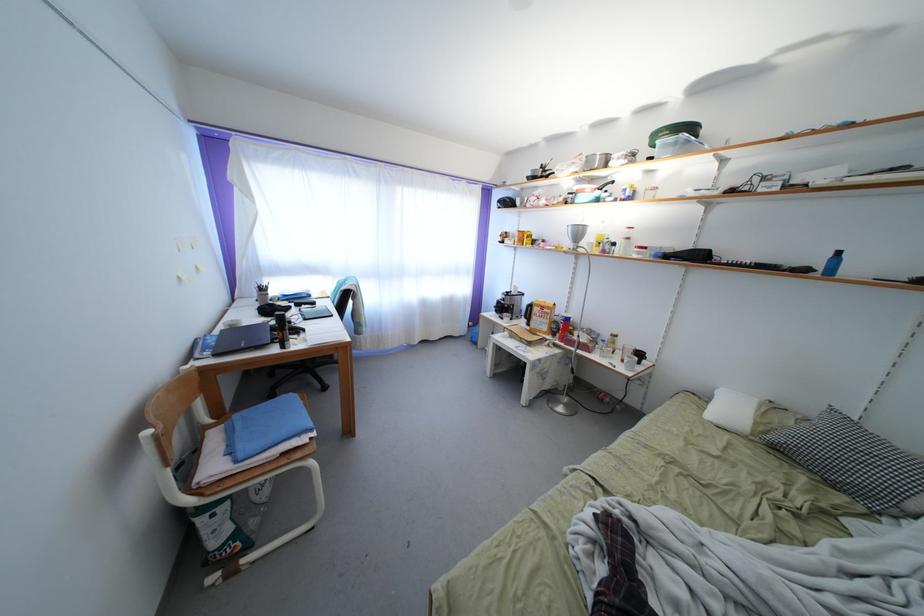
Find where to lift the blender pitcher. Please return your answer as a coordinate pair (x, y).

(511, 320)